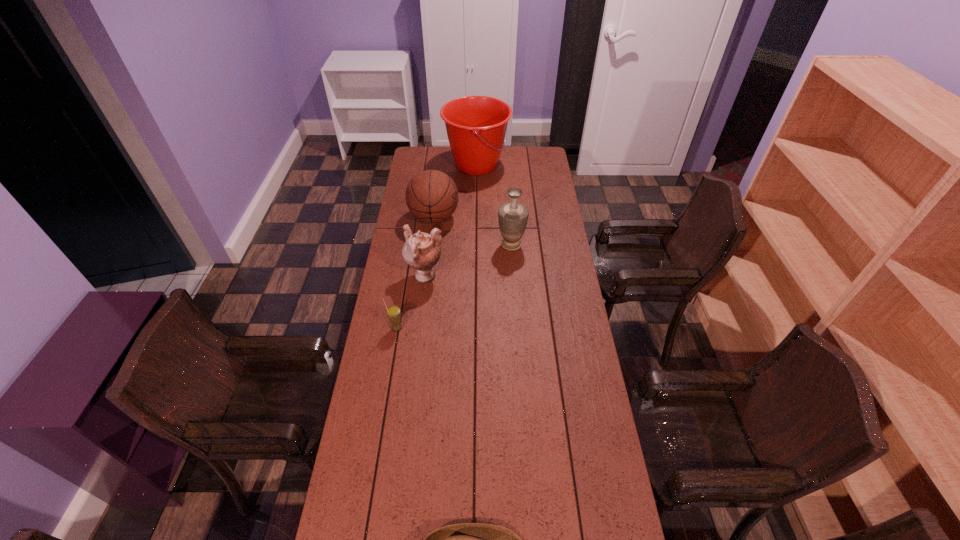
Find the location of `bucket`. bucket is located at coordinates (476, 126).

I want to click on the fourth nearest object, so 513,216.

At what (x,y) coordinates should I click in order to perform the action: click on the farther urn. Please return your answer as a coordinate pair (x, y). The width and height of the screenshot is (960, 540). Looking at the image, I should click on (513, 216).

At what (x,y) coordinates should I click in order to perform the action: click on the third nearest object. Please return your answer as a coordinate pair (x, y). Image resolution: width=960 pixels, height=540 pixels. Looking at the image, I should click on (421, 251).

The image size is (960, 540). Find the location of `the nearer urn`. the nearer urn is located at coordinates (421, 251).

This screenshot has height=540, width=960. I want to click on basketball, so click(431, 196).

Find the location of a particular element. the second nearest object is located at coordinates (393, 312).

Identify the location of the fifth tallest object. (393, 312).

Locate an element on the screen. The height and width of the screenshot is (540, 960). free space located 0.210m with the handle attached to the rim of the farthest object is located at coordinates (547, 165).

Where is `vacant space situated on the front of the right urn`? This screenshot has height=540, width=960. vacant space situated on the front of the right urn is located at coordinates [517, 322].